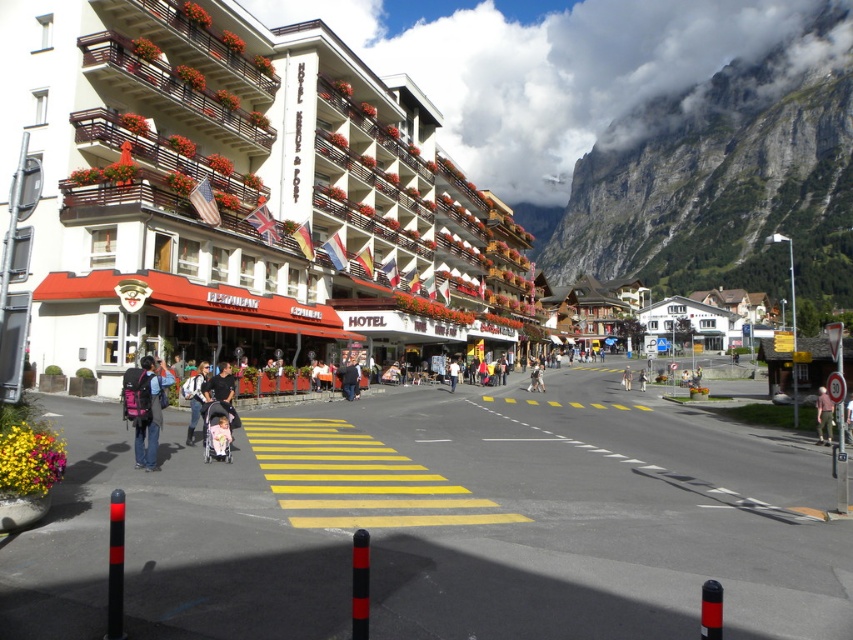
Can you confirm if light brown leather jacket at center is taller than dark blue jacket at center?

Yes, light brown leather jacket at center is taller than dark blue jacket at center.

Does light brown leather jacket at center appear under dark blue jacket at center?

Yes, light brown leather jacket at center is below dark blue jacket at center.

Between point (833, 417) and point (357, 392), which one is positioned in front?

Positioned in front is point (833, 417).

Where is `light brown leather jacket at center`? The width and height of the screenshot is (853, 640). light brown leather jacket at center is located at coordinates (822, 416).

Between denim jacket at lower left and dark blue jacket at center, which one is positioned lower?

Positioned lower is dark blue jacket at center.

Does point (192, 404) come behind point (347, 384)?

No, it is not.

Where is `denim jacket at lower left`? denim jacket at lower left is located at coordinates (195, 396).

Can you confirm if pink backpack at lower left is wider than light brown leather jacket at center?

No.

Which is in front, point (149, 451) or point (817, 429)?

Point (149, 451) is in front.

Locate an element on the screen. This screenshot has height=640, width=853. pink backpack at lower left is located at coordinates (144, 406).